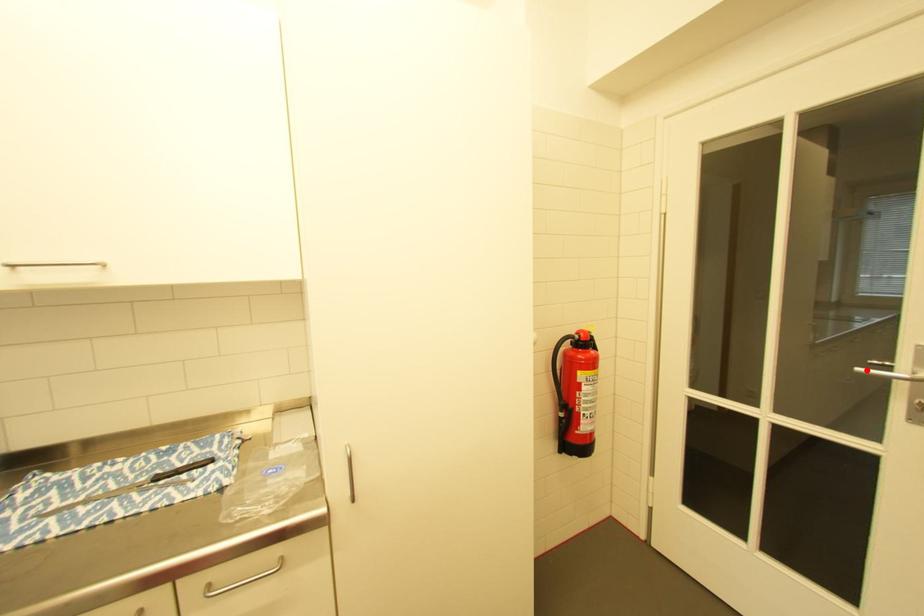
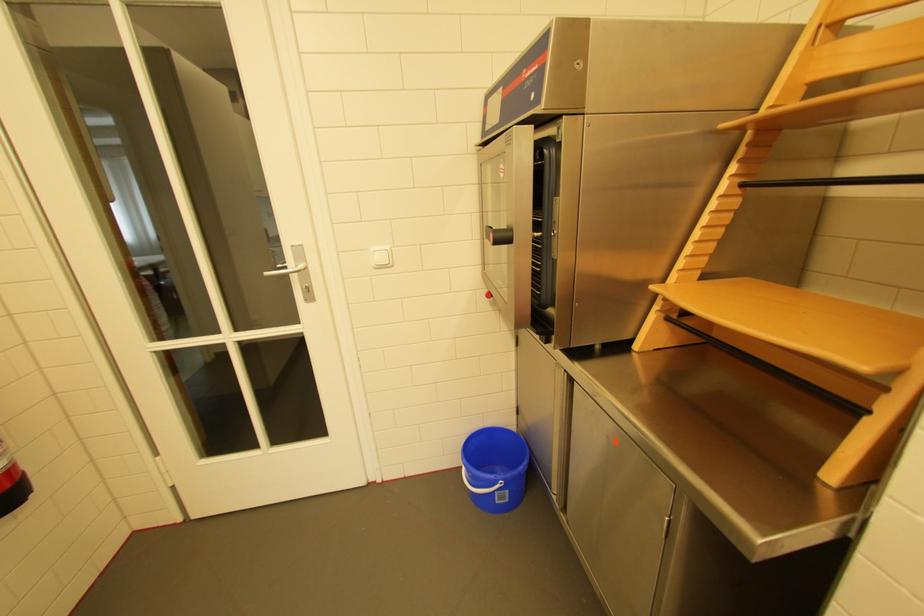
The point at the highlighted location is marked in the first image. Where is the corresponding point in the second image?

(274, 274)